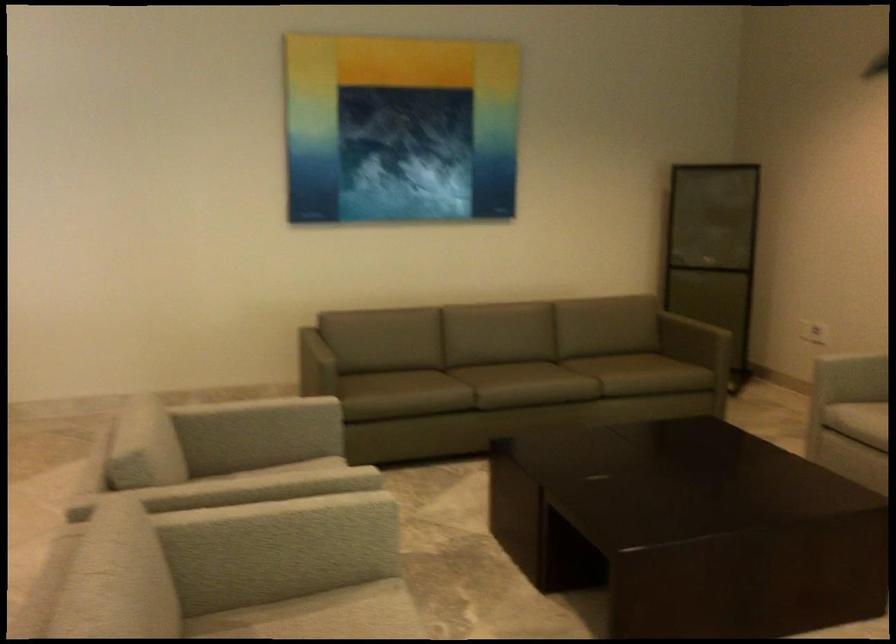
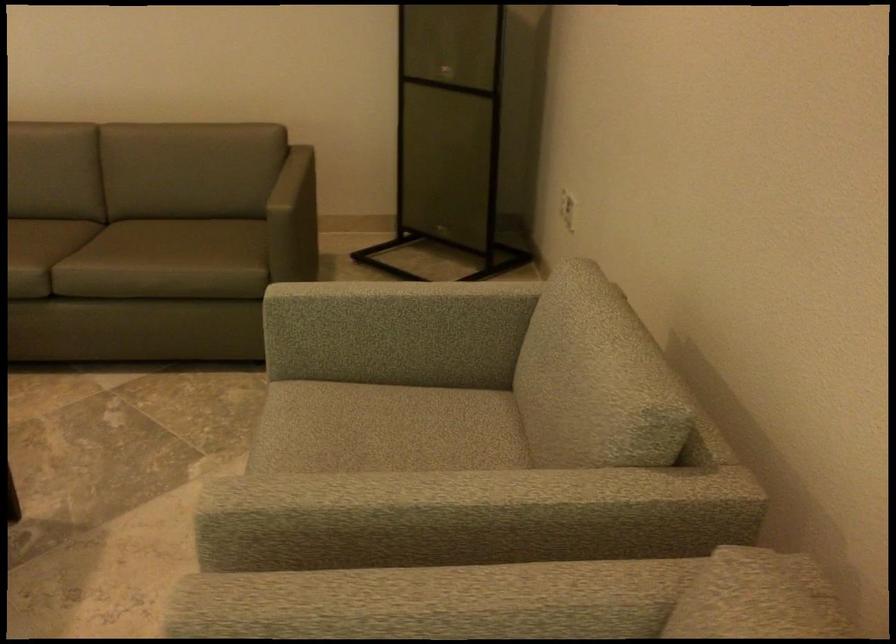
What movement of the cameraman would produce the second image?

The movement direction of the cameraman is right, forward.